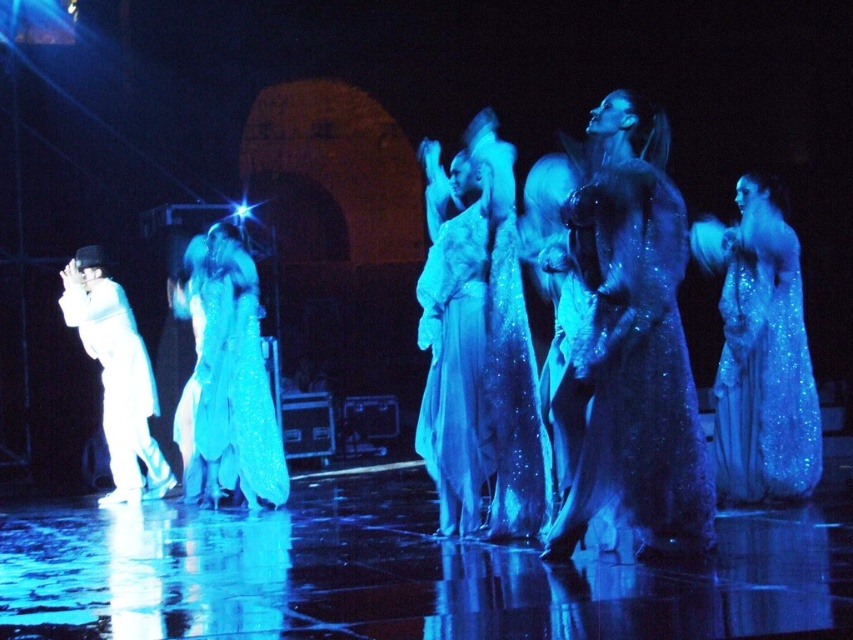
You are a photographer trying to capture the sparkly blue dress at right and the satin shimmering gown at center. Which performer is standing to the left of the other?

The sparkly blue dress at right is positioned on the right side of the satin shimmering gown at center, so the satin shimmering gown at center is to the left of the sparkly blue dress at right.

You are a photographer in the audience taking pictures of the sparkly blue dress at right and the white glossy suit at left. Which performer should you focus on first to capture them in the foreground?

You should focus on the sparkly blue dress at right first because it is closer to the viewer than the white glossy suit at left, making it the foreground subject.